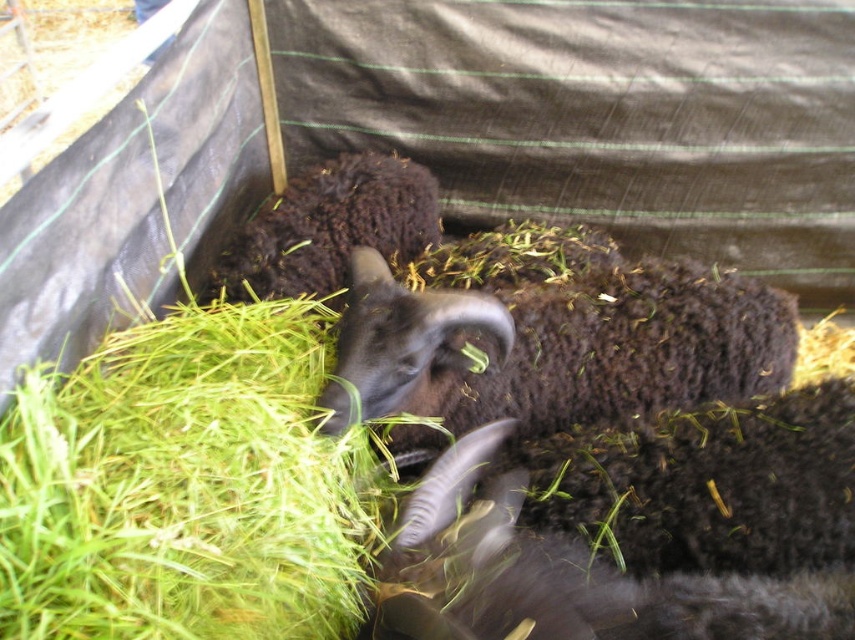
Who is shorter, green grass at lower left or dark woolen goat at center?

dark woolen goat at center

Between point (28, 634) and point (614, 410), which one is positioned behind?

Point (614, 410)

Is point (103, 474) behind point (352, 316)?

No, (103, 474) is in front of (352, 316).

This screenshot has height=640, width=855. What are the coordinates of `green grass at lower left` in the screenshot? It's located at 186,486.

Which is more to the right, green grass at lower left or dark brown woolen sheep at center?

Positioned to the right is dark brown woolen sheep at center.

Does green grass at lower left appear on the left side of dark brown woolen sheep at center?

Correct, you'll find green grass at lower left to the left of dark brown woolen sheep at center.

What are the coordinates of `green grass at lower left` in the screenshot? It's located at (186, 486).

Which is more to the left, green grass at lower left or dark woolen sheep at center?

Positioned to the left is dark woolen sheep at center.

Is green grass at lower left further to the viewer compared to dark woolen sheep at center?

No, it is in front of dark woolen sheep at center.

Who is more forward, (x=314, y=525) or (x=314, y=212)?

Point (x=314, y=525) is more forward.

Where is `green grass at lower left`? This screenshot has height=640, width=855. green grass at lower left is located at coordinates (186, 486).